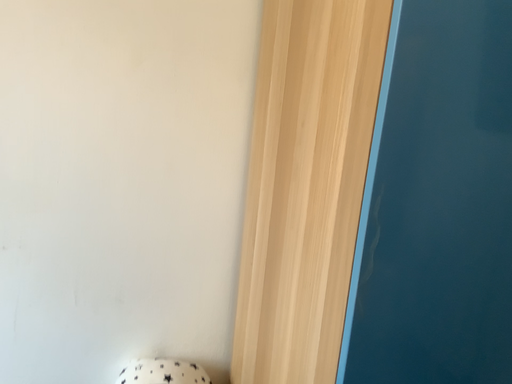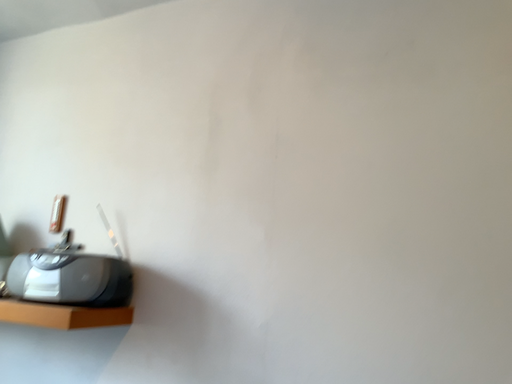
Question: Which way did the camera rotate in the video?

Choices:
 (A) rotated upward
 (B) rotated downward

Answer: (A)